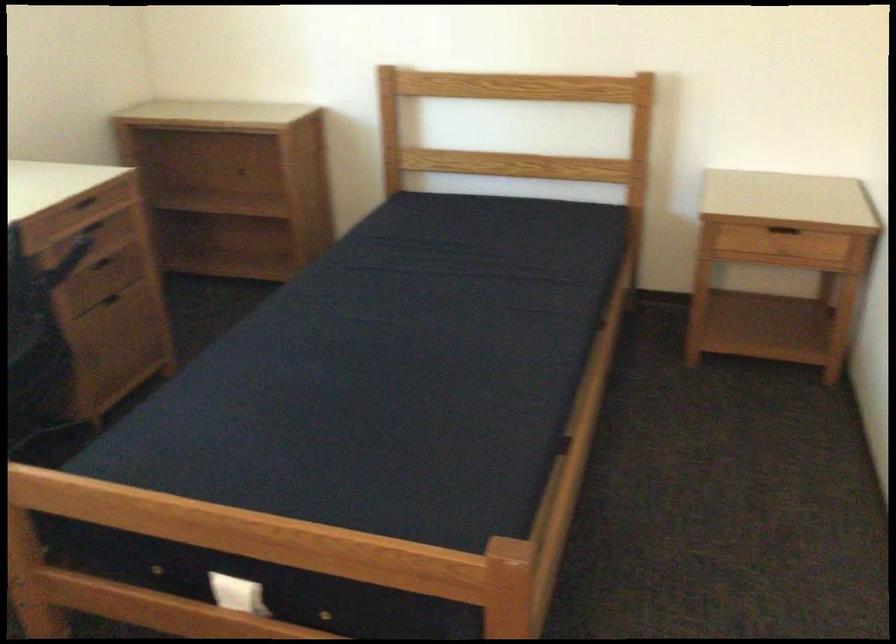
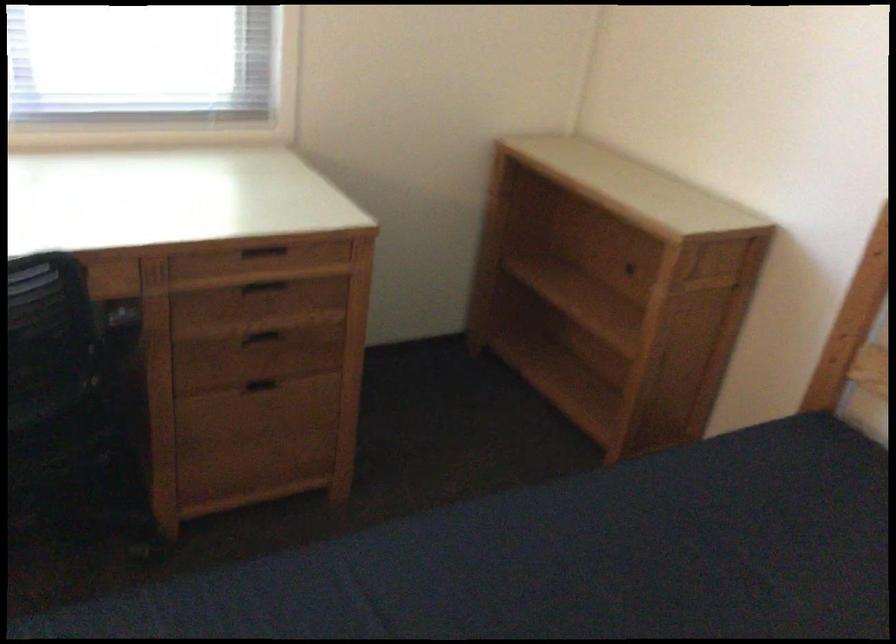
Find the pixel in the second image that matches pixel 82 207 in the first image.

(263, 252)